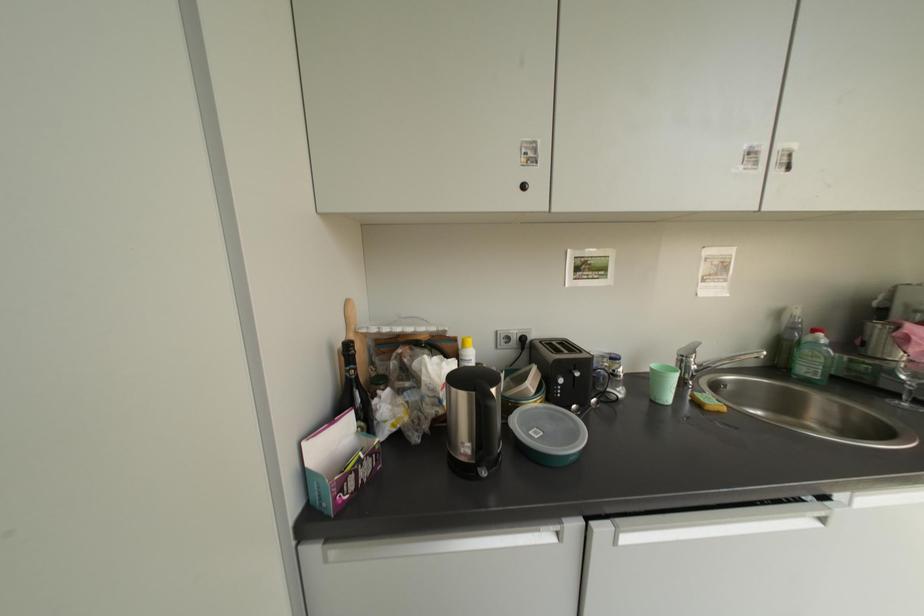
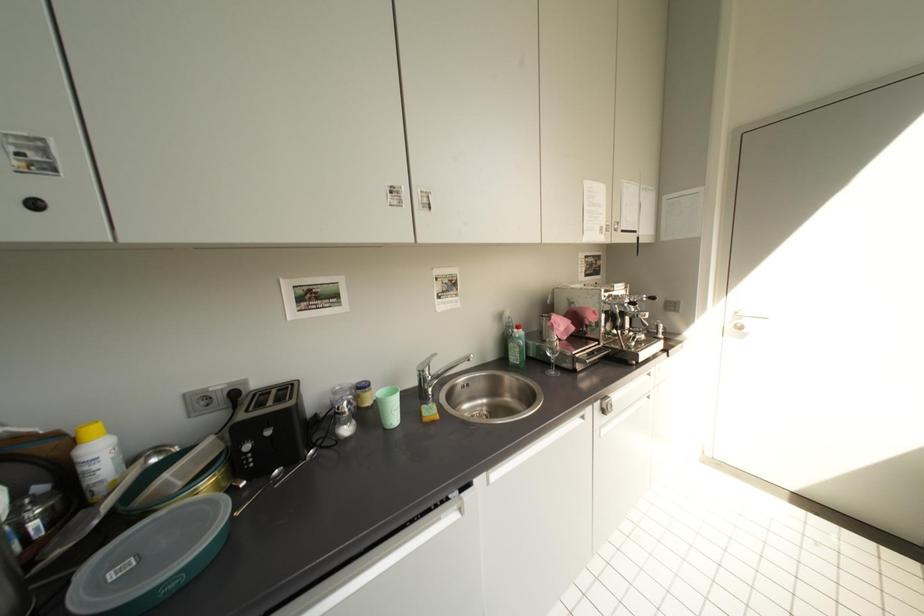
Question: What movement of the cameraman would produce the second image?

Choices:
 (A) Left
 (B) Right
 (C) Forward
 (D) Backward

Answer: (B)